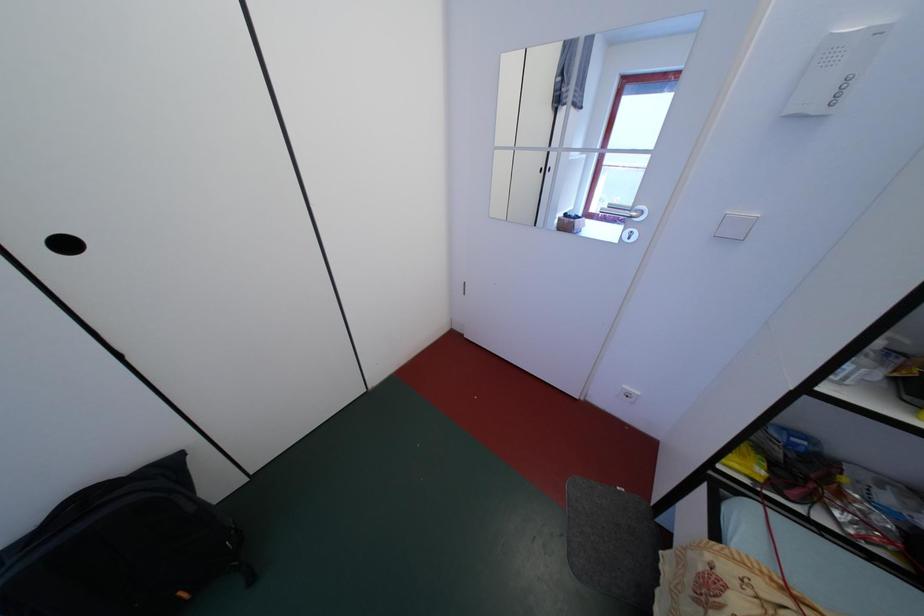
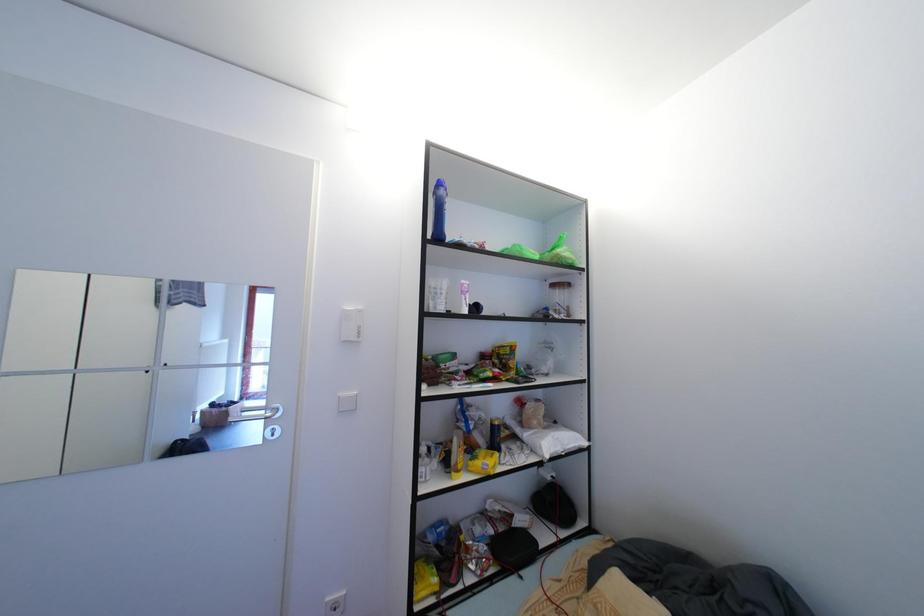
Consider the image. The first image is from the beginning of the video and the second image is from the end. How did the camera likely rotate when shooting the video?

The rotation direction of the camera is right-up.